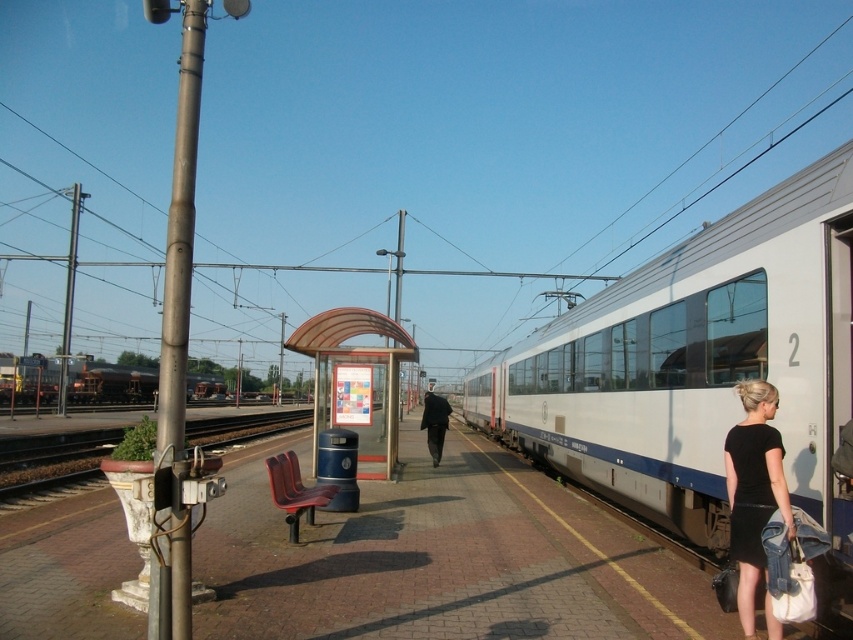
Question: Estimate the real-world distances between objects in this image. Which object is farther from the dark gray fabric coat at center?

Choices:
 (A) dark gray metal train at left
 (B) red plastic bench at center
 (C) white glossy train at right
 (D) black matte dress at lower right

Answer: (A)

Question: Among these points, which one is nearest to the camera?

Choices:
 (A) [x=740, y=477]
 (B) [x=24, y=390]

Answer: (A)

Question: Considering the relative positions of dark gray metal train at left and dark gray fabric coat at center in the image provided, where is dark gray metal train at left located with respect to dark gray fabric coat at center?

Choices:
 (A) left
 (B) right

Answer: (A)

Question: Is red plastic bench at center wider than brown wooden train track at lower left?

Choices:
 (A) no
 (B) yes

Answer: (A)

Question: Does black matte dress at lower right come behind dark gray metal train at left?

Choices:
 (A) no
 (B) yes

Answer: (A)

Question: Estimate the real-world distances between objects in this image. Which object is closer to the red plastic bench at center?

Choices:
 (A) black matte dress at lower right
 (B) brown wooden train track at lower left
 (C) dark gray metal train at left

Answer: (A)